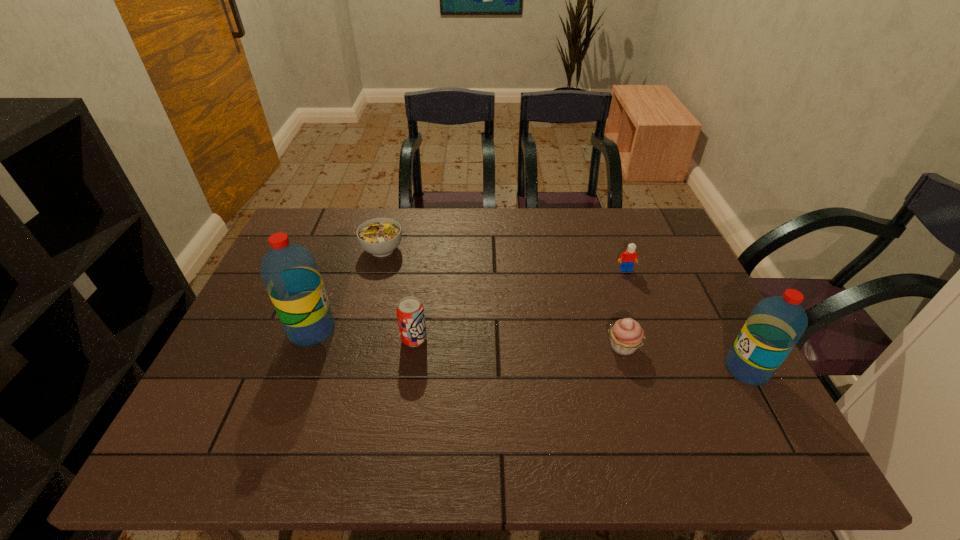
Find the location of a particular element. the left water bottle is located at coordinates (289, 271).

Identify the location of the taller water bottle. (289, 271).

Image resolution: width=960 pixels, height=540 pixels. Find the location of `the fifth shortest object`. the fifth shortest object is located at coordinates (775, 325).

Find the location of `the right water bottle`. the right water bottle is located at coordinates (775, 325).

The image size is (960, 540). Find the location of `the shortest object`. the shortest object is located at coordinates (380, 237).

The height and width of the screenshot is (540, 960). Find the location of `soup bowl`. soup bowl is located at coordinates (380, 237).

Locate an element on the screen. The width and height of the screenshot is (960, 540). cupcake is located at coordinates (626, 335).

Locate an element on the screen. The width and height of the screenshot is (960, 540). the third object from left to right is located at coordinates point(410,313).

I want to click on soda can, so click(x=410, y=313).

I want to click on Lego, so click(627, 259).